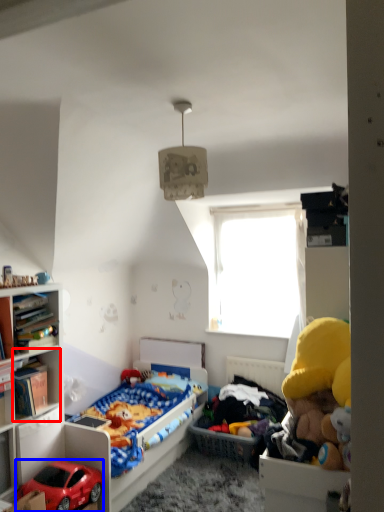
Question: Which of the following is the closest to the observer, cabinet (highlighted by a red box) or car (highlighted by a blue box)?

Choices:
 (A) cabinet
 (B) car

Answer: (B)